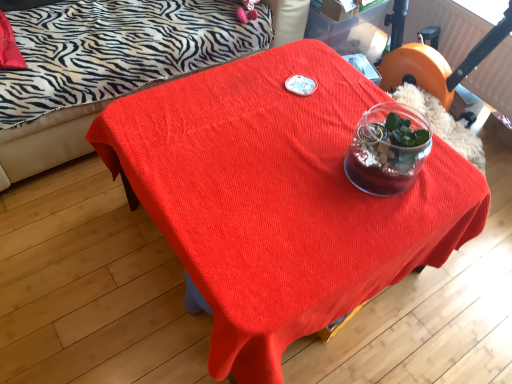
Question: Does matte red table at center appear on the left side of zebra-patterned fabric couch at upper left?

Choices:
 (A) no
 (B) yes

Answer: (A)

Question: From a real-world perspective, is matte red table at center positioned over zebra-patterned fabric couch at upper left based on gravity?

Choices:
 (A) yes
 (B) no

Answer: (B)

Question: Considering the relative positions of matte red table at center and zebra-patterned fabric couch at upper left in the image provided, is matte red table at center to the right of zebra-patterned fabric couch at upper left from the viewer's perspective?

Choices:
 (A) no
 (B) yes

Answer: (B)

Question: Is matte red table at center looking in the opposite direction of zebra-patterned fabric couch at upper left?

Choices:
 (A) yes
 (B) no

Answer: (B)

Question: Is matte red table at center shorter than zebra-patterned fabric couch at upper left?

Choices:
 (A) yes
 (B) no

Answer: (A)

Question: Does matte red table at center have a greater height compared to zebra-patterned fabric couch at upper left?

Choices:
 (A) no
 (B) yes

Answer: (A)

Question: From the image's perspective, is zebra-patterned fabric couch at upper left beneath orange plastic swivel chair at upper right?

Choices:
 (A) no
 (B) yes

Answer: (A)

Question: Is the position of zebra-patterned fabric couch at upper left more distant than that of orange plastic swivel chair at upper right?

Choices:
 (A) yes
 (B) no

Answer: (B)

Question: Is there a large distance between zebra-patterned fabric couch at upper left and orange plastic swivel chair at upper right?

Choices:
 (A) no
 (B) yes

Answer: (B)

Question: Is zebra-patterned fabric couch at upper left shorter than orange plastic swivel chair at upper right?

Choices:
 (A) yes
 (B) no

Answer: (B)

Question: Is zebra-patterned fabric couch at upper left wider than orange plastic swivel chair at upper right?

Choices:
 (A) no
 (B) yes

Answer: (B)

Question: From a real-world perspective, is zebra-patterned fabric couch at upper left below orange plastic swivel chair at upper right?

Choices:
 (A) no
 (B) yes

Answer: (A)

Question: From a real-world perspective, is matte red table at center on orange plastic swivel chair at upper right?

Choices:
 (A) no
 (B) yes

Answer: (A)